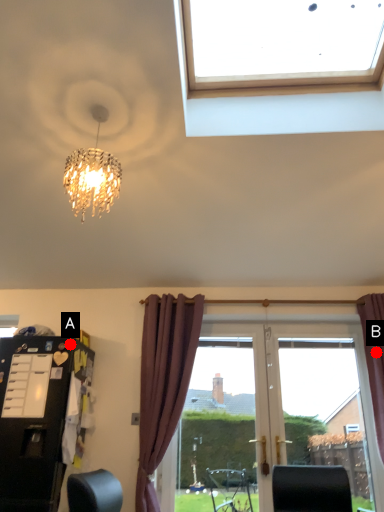
Question: Two points are circled on the image, labeled by A and B beside each circle. Which point is further to the camera?

Choices:
 (A) A is further
 (B) B is further

Answer: (B)